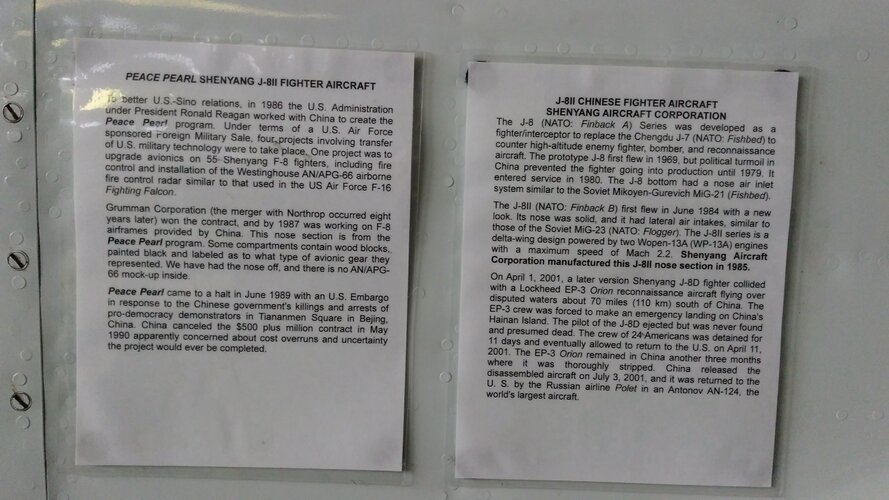
At what (x,y) coordinates should I click in order to perform the action: click on screws. Please return your answer as a coordinate pair (x, y). This screenshot has width=889, height=500. Looking at the image, I should click on (20, 400), (21, 264), (13, 106).